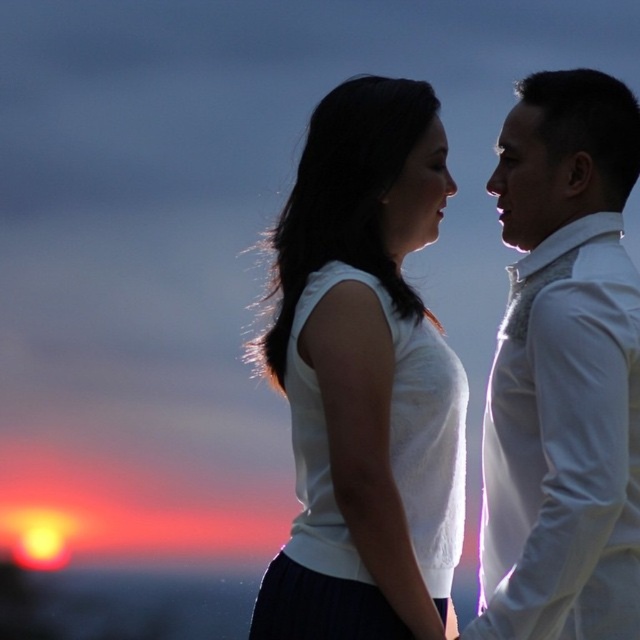
Question: Is white matte tank top at center bigger than white textured shirt at right?

Choices:
 (A) yes
 (B) no

Answer: (B)

Question: Is white matte tank top at center bigger than white textured shirt at right?

Choices:
 (A) no
 (B) yes

Answer: (A)

Question: Which point is closer to the camera?

Choices:
 (A) (516, 188)
 (B) (360, 573)

Answer: (B)

Question: Which of the following is the farthest from the observer?

Choices:
 (A) white matte tank top at center
 (B) white textured shirt at right

Answer: (A)

Question: Does white matte tank top at center have a greater width compared to white textured shirt at right?

Choices:
 (A) yes
 (B) no

Answer: (A)